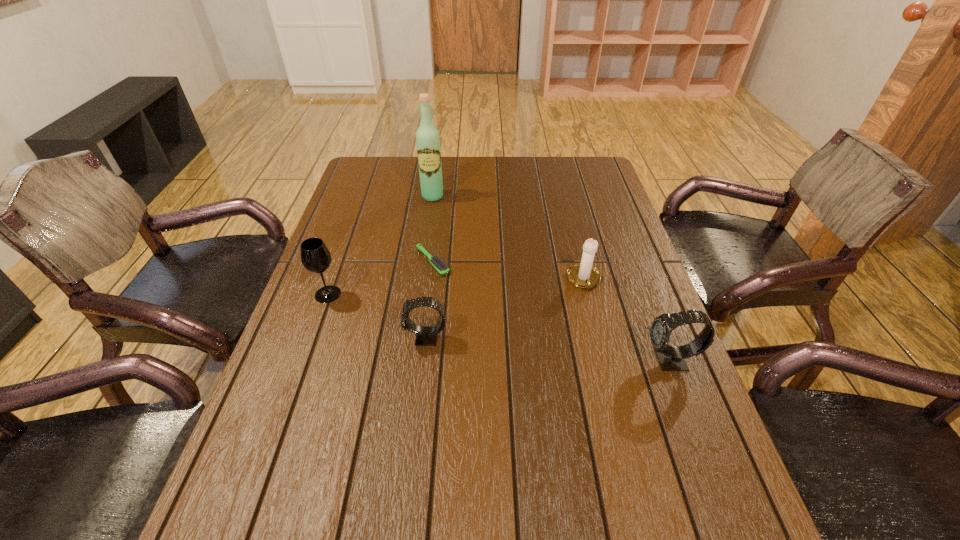
This screenshot has height=540, width=960. In order to click on the shorter watch in this screenshot , I will do `click(425, 335)`.

Identify the location of the rightmost object. (671, 358).

The height and width of the screenshot is (540, 960). I want to click on the right watch, so click(671, 358).

I want to click on the shortest object, so click(x=436, y=261).

Identify the location of wineglass. (315, 256).

Where is `the tallest object`? This screenshot has height=540, width=960. the tallest object is located at coordinates (427, 136).

Locate an element on the screen. The image size is (960, 540). the farthest object is located at coordinates (427, 136).

Where is `candle holder`? The image size is (960, 540). candle holder is located at coordinates (584, 275).

Where is `free space located 0.110m on the face of the shorter watch`? The height and width of the screenshot is (540, 960). free space located 0.110m on the face of the shorter watch is located at coordinates (358, 338).

This screenshot has width=960, height=540. I want to click on free space located on the face of the shorter watch, so click(x=375, y=338).